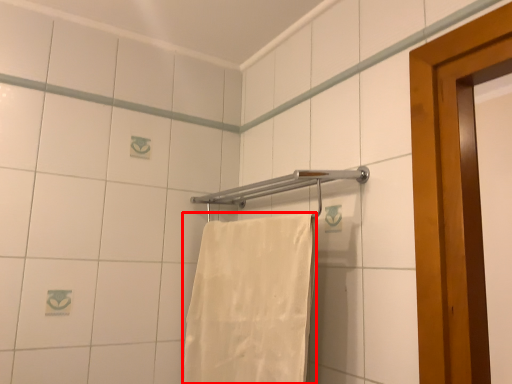
Question: In this image, where is towel (annotated by the red box) located relative to towel bar?

Choices:
 (A) right
 (B) left

Answer: (B)